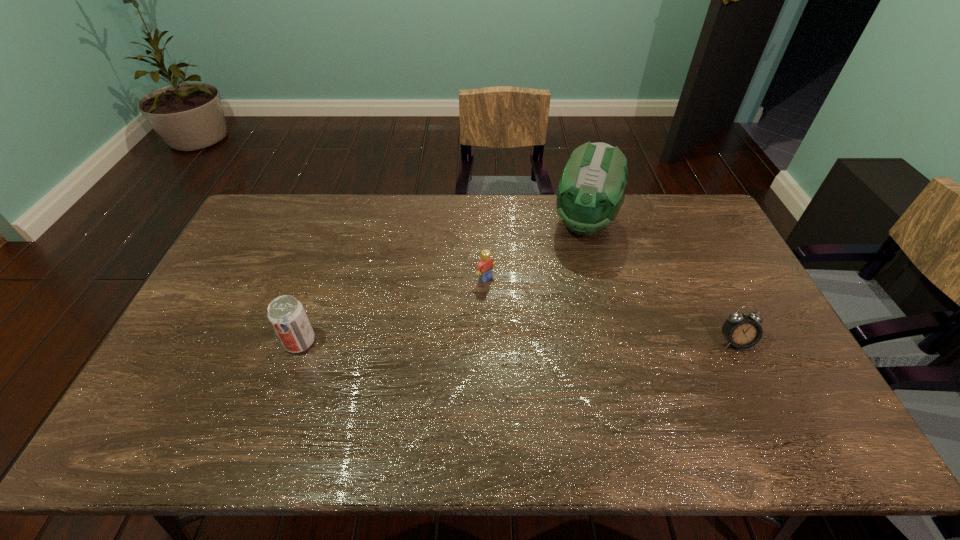
This screenshot has height=540, width=960. Identify the location of free space on the desktop that is between the second tallest object and the alarm clock and is positioned on the front-facing side of the Lego. (564, 342).

Find the location of a particular element. The image size is (960, 540). vacant spot on the desktop that is between the third shortest object and the rightmost object and is positioned on the visor of the tallest object is located at coordinates (544, 342).